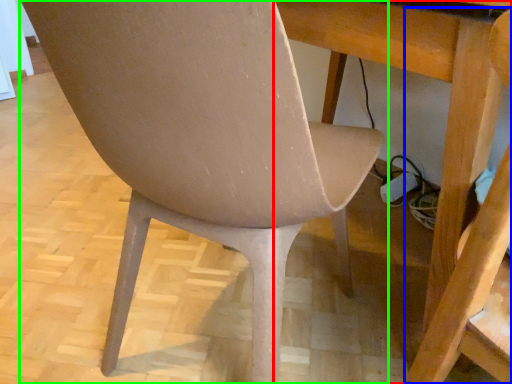
Question: Which is nearer to the table (highlighted by a red box)? swivel chair (highlighted by a blue box) or chair (highlighted by a green box).

Choices:
 (A) swivel chair
 (B) chair

Answer: (A)